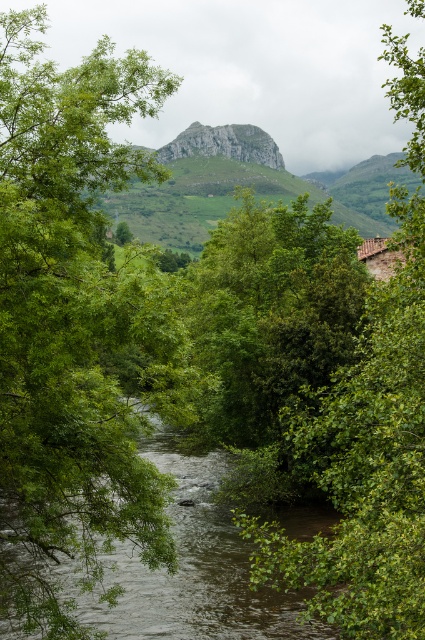
Question: Can you confirm if green leafy tree at center is positioned above green leafy stream at center?

Choices:
 (A) yes
 (B) no

Answer: (A)

Question: Does green leafy tree at left have a smaller size compared to green leafy tree at center?

Choices:
 (A) yes
 (B) no

Answer: (A)

Question: Which point is closer to the camera?

Choices:
 (A) green leafy tree at left
 (B) green leafy tree at center

Answer: (B)

Question: Estimate the real-world distances between objects in this image. Which object is closer to the green leafy stream at center?

Choices:
 (A) rugged stone mountain at center
 (B) green leafy tree at left

Answer: (B)

Question: Which object is farther from the camera taking this photo?

Choices:
 (A) green leafy tree at left
 (B) green leafy tree at center

Answer: (A)

Question: Does green leafy tree at left appear under rugged stone mountain at center?

Choices:
 (A) yes
 (B) no

Answer: (A)